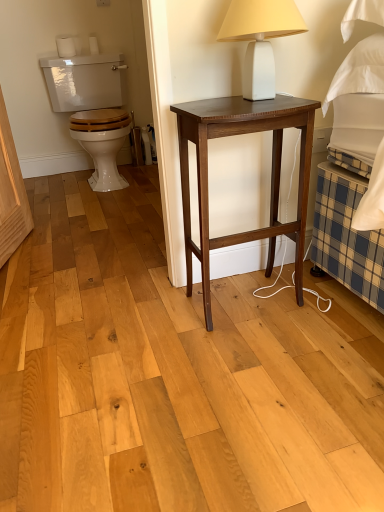
Question: Is white glossy toilet at left smaller than white matte table lamp at upper center?

Choices:
 (A) no
 (B) yes

Answer: (A)

Question: Considering the relative sizes of white glossy toilet at left and white matte table lamp at upper center in the image provided, is white glossy toilet at left thinner than white matte table lamp at upper center?

Choices:
 (A) yes
 (B) no

Answer: (B)

Question: Is white glossy toilet at left outside white matte table lamp at upper center?

Choices:
 (A) no
 (B) yes

Answer: (B)

Question: Could white matte table lamp at upper center be considered to be inside white glossy toilet at left?

Choices:
 (A) no
 (B) yes

Answer: (A)

Question: Does white glossy toilet at left appear on the right side of white matte table lamp at upper center?

Choices:
 (A) yes
 (B) no

Answer: (B)

Question: Is white glossy toilet at left aimed at white matte table lamp at upper center?

Choices:
 (A) yes
 (B) no

Answer: (A)

Question: Is white glossy toilet at left closer to camera compared to dark wood nightstand at center?

Choices:
 (A) yes
 (B) no

Answer: (B)

Question: From a real-world perspective, is white glossy toilet at left below dark wood nightstand at center?

Choices:
 (A) yes
 (B) no

Answer: (B)

Question: Would you say dark wood nightstand at center is part of white glossy toilet at left's contents?

Choices:
 (A) no
 (B) yes

Answer: (A)

Question: Can you confirm if white glossy toilet at left is smaller than dark wood nightstand at center?

Choices:
 (A) yes
 (B) no

Answer: (B)

Question: Is white glossy toilet at left oriented towards dark wood nightstand at center?

Choices:
 (A) yes
 (B) no

Answer: (A)

Question: Is white glossy toilet at left wider than dark wood nightstand at center?

Choices:
 (A) no
 (B) yes

Answer: (B)

Question: Considering the relative sizes of white matte table lamp at upper center and dark wood nightstand at center in the image provided, is white matte table lamp at upper center thinner than dark wood nightstand at center?

Choices:
 (A) yes
 (B) no

Answer: (A)